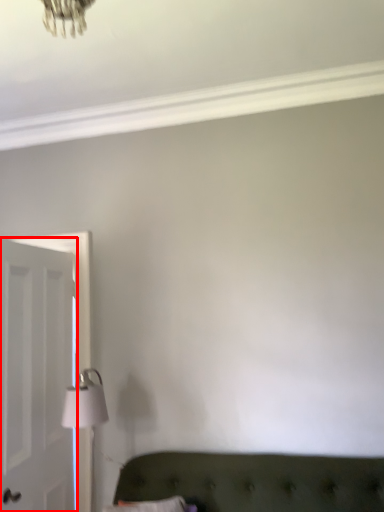
Question: From the image, what is the correct spatial relationship of door (annotated by the red box) in relation to table lamp?

Choices:
 (A) left
 (B) right

Answer: (A)